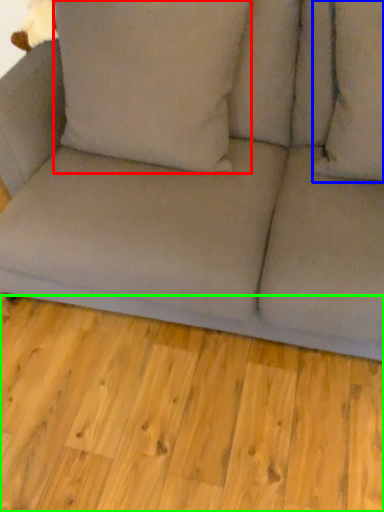
Question: Considering the real-world distances, which object is closest to pillow (highlighted by a red box)? pillow (highlighted by a blue box) or plank (highlighted by a green box).

Choices:
 (A) pillow
 (B) plank

Answer: (A)